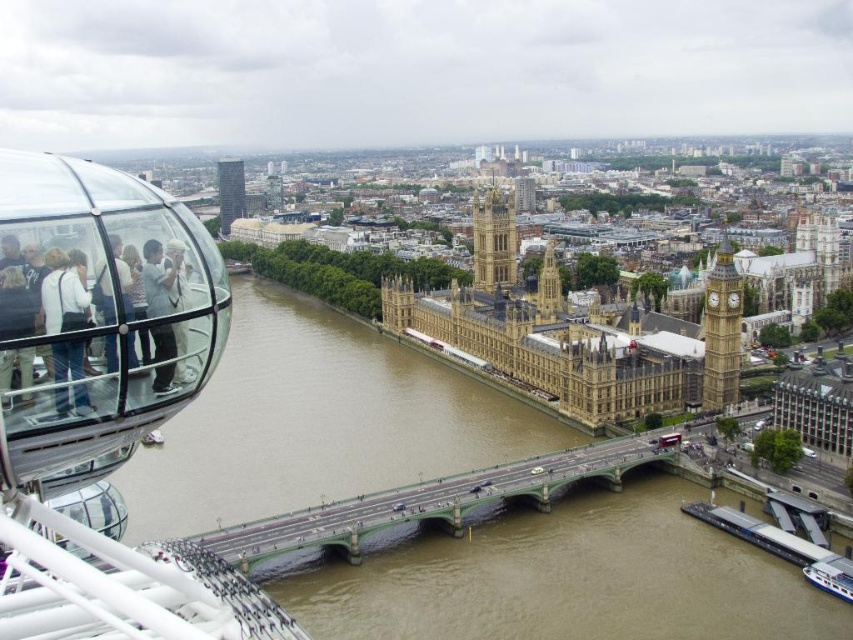
Which is in front, point (491, 234) or point (13, 323)?

Point (13, 323)

Can you confirm if golden stone clock tower at center is wider than light brown leather jacket at left?

Yes, golden stone clock tower at center is wider than light brown leather jacket at left.

Which is in front, point (495, 241) or point (27, 292)?

Positioned in front is point (27, 292).

This screenshot has height=640, width=853. In order to click on golden stone clock tower at center in this screenshot , I will do `click(492, 241)`.

Is light brown leather jacket at left taller than light gray fabric people at left?

Yes.

Between light brown leather jacket at left and light gray fabric people at left, which one has more height?

With more height is light brown leather jacket at left.

I want to click on light brown leather jacket at left, so click(15, 305).

This screenshot has height=640, width=853. In order to click on light brown leather jacket at left in this screenshot , I will do `click(15, 305)`.

Can you confirm if brown/muddy water at center is smaller than light gray fabric people at left?

Actually, brown/muddy water at center might be larger than light gray fabric people at left.

Does brown/muddy water at center have a larger size compared to light gray fabric people at left?

Indeed, brown/muddy water at center has a larger size compared to light gray fabric people at left.

Who is more forward, (527, 612) or (120, 300)?

Point (120, 300)

You are a GUI agent. You are given a task and a screenshot of the screen. Output one action in this format:
    pyautogui.click(x=<x>, y=<y>)
    Task: Click on the brown/muddy water at center
    This screenshot has height=640, width=853.
    Given the screenshot: What is the action you would take?
    pyautogui.click(x=560, y=577)